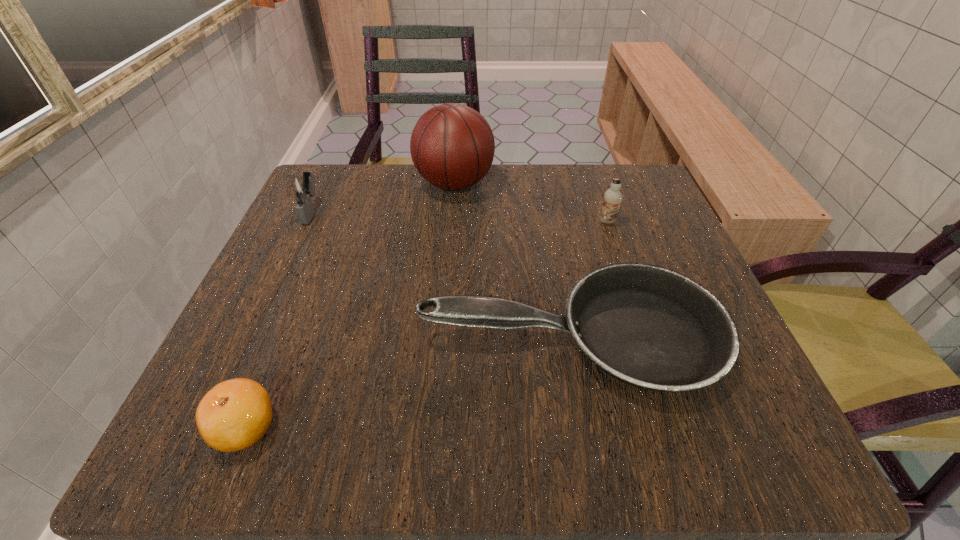
At what (x,y) coordinates should I click in order to perform the action: click on free space between the clementine and the frying pan. Please return your answer as a coordinate pair (x, y). The width and height of the screenshot is (960, 540). Looking at the image, I should click on (408, 382).

Locate an element on the screen. The width and height of the screenshot is (960, 540). empty space between the igniter and the clementine is located at coordinates (278, 319).

The height and width of the screenshot is (540, 960). I want to click on unoccupied position between the basketball and the clementine, so click(x=350, y=306).

This screenshot has height=540, width=960. Find the location of `vacant space that's between the igniter and the tallest object`. vacant space that's between the igniter and the tallest object is located at coordinates (383, 198).

You are a GUI agent. You are given a task and a screenshot of the screen. Output one action in this format:
    pyautogui.click(x=<x>, y=<y>)
    Task: Click on the vacant space that is in between the basketball and the frying pan
    
    Given the screenshot: What is the action you would take?
    pyautogui.click(x=513, y=260)

Where is `free space that is in between the tallest object and the chocolate milk`? free space that is in between the tallest object and the chocolate milk is located at coordinates tap(531, 202).

I want to click on blank region between the chocolate milk and the clementine, so click(x=426, y=325).

This screenshot has height=540, width=960. Find the location of `vacant region between the tallest object and the chocolate milk`. vacant region between the tallest object and the chocolate milk is located at coordinates (531, 202).

Select which object is the fourth closest to the chocolate milk. Please provide its 2D coordinates. Your answer should be formatted as a tuple, i.e. [(x, y)], where the tuple contains the x and y coordinates of a point satisfying the conditions above.

[(235, 414)]

I want to click on the third closest object to the tallest object, so click(x=647, y=326).